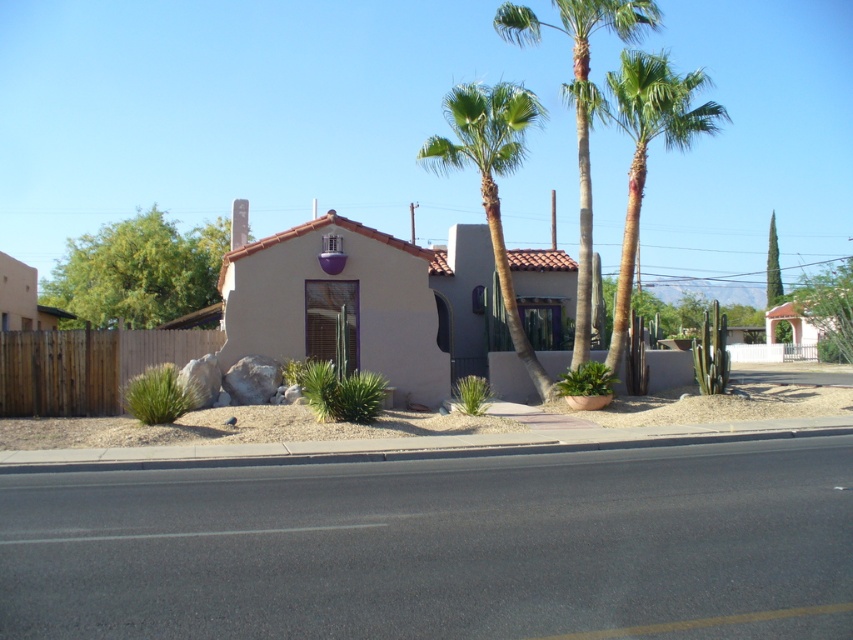
Question: Estimate the real-world distances between objects in this image. Which object is closer to the brown wooden fence at left?

Choices:
 (A) green leafy tree at upper right
 (B) green leafy tree at center
 (C) green leafy palm trees at upper center

Answer: (C)

Question: Does brown wooden fence at left lie in front of green leafy tree at center?

Choices:
 (A) no
 (B) yes

Answer: (B)

Question: Does green leafy tree at upper left have a smaller size compared to green leafy tree at center?

Choices:
 (A) no
 (B) yes

Answer: (A)

Question: Is green leafy tree at upper left above green leafy palm tree at upper right?

Choices:
 (A) no
 (B) yes

Answer: (A)

Question: Among these points, which one is farthest from the camera?

Choices:
 (A) (845, 324)
 (B) (766, 307)
 (C) (16, 362)

Answer: (B)

Question: Which object is closer to the camera taking this photo?

Choices:
 (A) green leafy palm tree at center
 (B) green leafy palm tree at upper right

Answer: (B)